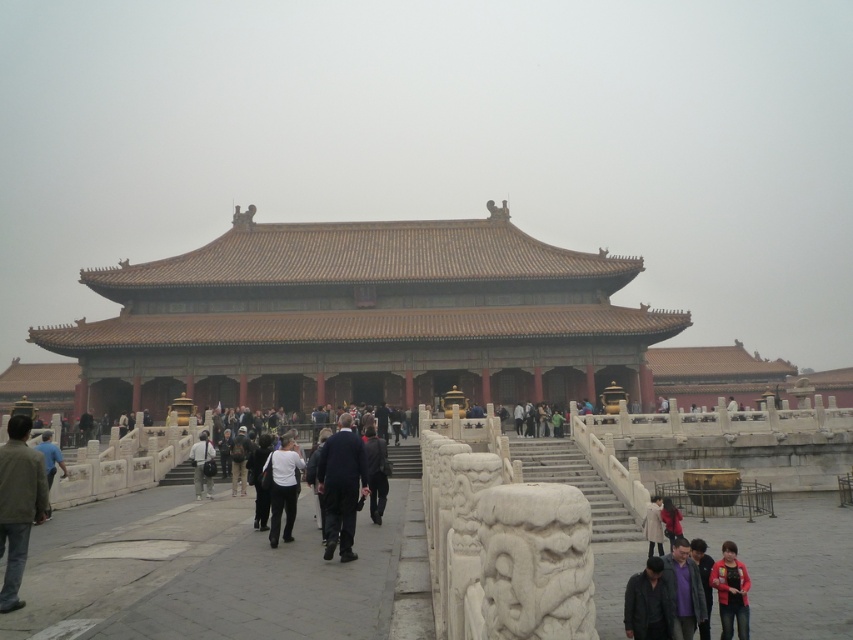
Between dark gray fabric jacket at lower center and dark brown leather jacket at lower right, which one has less height?

dark gray fabric jacket at lower center is shorter.

Looking at this image, which is above, dark gray fabric jacket at lower center or dark brown leather jacket at lower right?

dark gray fabric jacket at lower center is above.

Is point (659, 612) farther from camera compared to point (672, 504)?

No.

Identify the location of dark gray fabric jacket at lower center. This screenshot has width=853, height=640. (647, 604).

Who is more distant from viewer, (24, 474) or (653, 515)?

The point (653, 515) is behind.

Is point (28, 532) farther from camera compared to point (654, 502)?

No, it is in front of (654, 502).

This screenshot has height=640, width=853. I want to click on light brown leather jacket at lower left, so click(18, 504).

Is point (428, 246) behind point (645, 515)?

Yes, it is behind point (645, 515).

Does point (343, 246) lie in front of point (654, 545)?

No.

Find the location of a particular element. Image resolution: width=853 pixels, height=640 pixels. brown tiled roof at center is located at coordinates (361, 320).